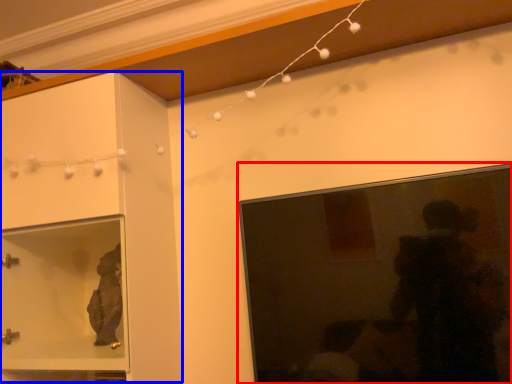
Question: Which of the following is the farthest to the observer, picture frame (highlighted by a red box) or cabinetry (highlighted by a blue box)?

Choices:
 (A) picture frame
 (B) cabinetry

Answer: (B)